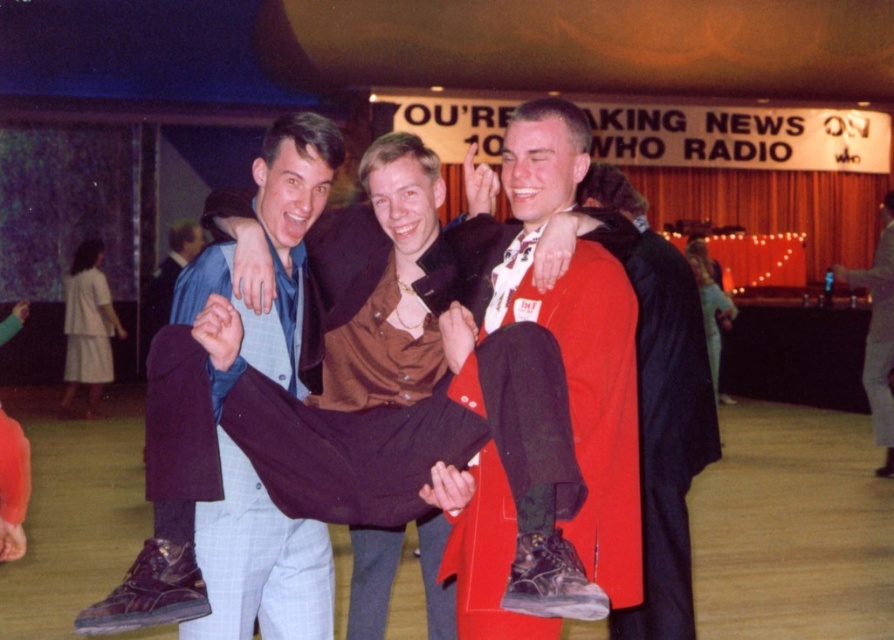
Question: Can you confirm if light blue plaid pants at center is positioned to the left of brown leather jacket at center?

Choices:
 (A) yes
 (B) no

Answer: (A)

Question: Is light blue plaid pants at center thinner than brown leather jacket at center?

Choices:
 (A) yes
 (B) no

Answer: (A)

Question: Observing the image, what is the correct spatial positioning of light blue plaid pants at center in reference to brown leather jacket at center?

Choices:
 (A) right
 (B) left

Answer: (B)

Question: Which object is closer to the camera taking this photo?

Choices:
 (A) light blue plaid pants at center
 (B) brown leather jacket at center

Answer: (A)